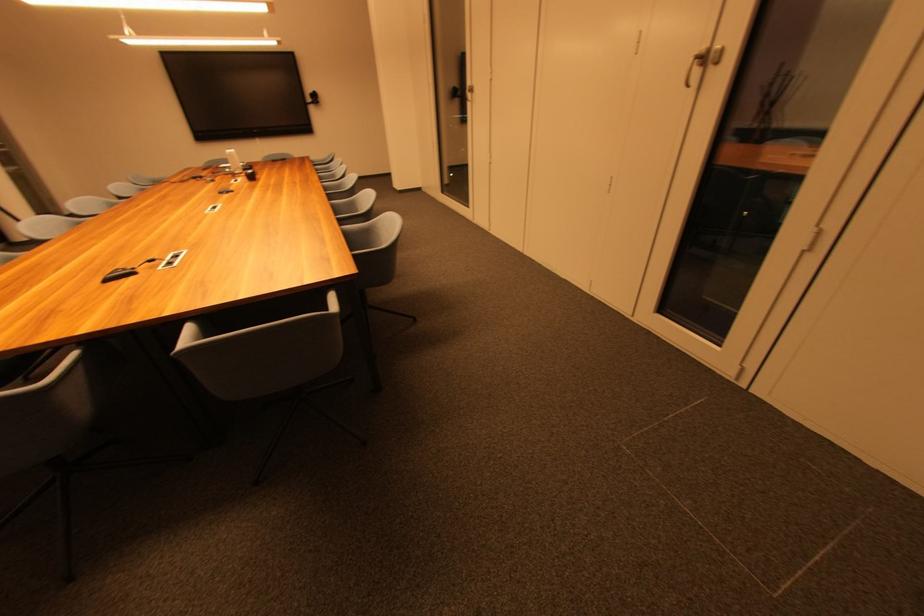
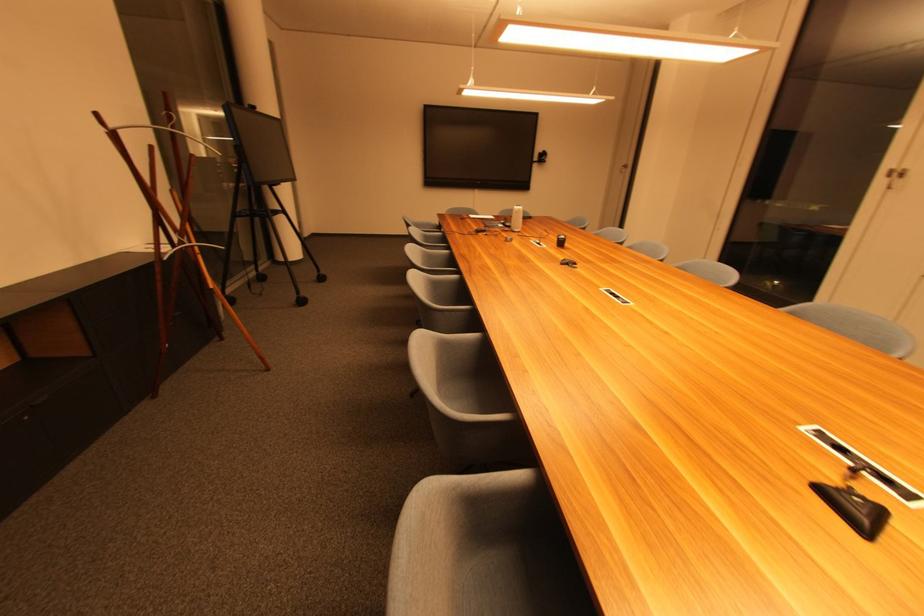
Question: The images are taken continuously from a first-person perspective. In which direction are you moving?

Choices:
 (A) Left
 (B) Right
 (C) Forward
 (D) Backward

Answer: (A)